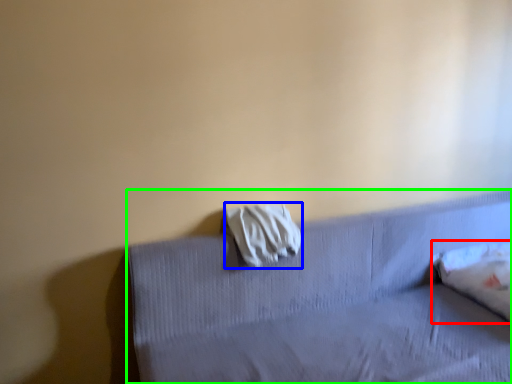
Question: Considering the real-world distances, which object is closest to pillow (highlighted by a red box)? material (highlighted by a blue box) or furniture (highlighted by a green box).

Choices:
 (A) material
 (B) furniture

Answer: (B)